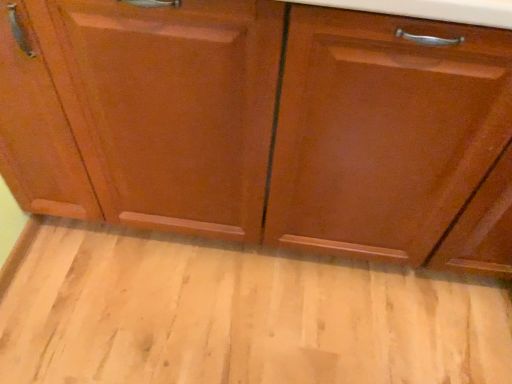
Locate an element on the screen. The width and height of the screenshot is (512, 384). matte wood floor at lower center is located at coordinates (239, 315).

What do you see at coordinates (239, 315) in the screenshot? The image size is (512, 384). I see `matte wood floor at lower center` at bounding box center [239, 315].

The height and width of the screenshot is (384, 512). What do you see at coordinates (429, 25) in the screenshot? I see `glossy wood drawer at right` at bounding box center [429, 25].

Locate an element on the screen. glossy wood drawer at right is located at coordinates (429, 25).

Locate an element on the screen. matte wood floor at lower center is located at coordinates (239, 315).

Which object is positioned more to the left, matte wood floor at lower center or glossy wood drawer at right?

From the viewer's perspective, matte wood floor at lower center appears more on the left side.

In the scene shown: Considering the relative positions of matte wood floor at lower center and glossy wood drawer at right in the image provided, is matte wood floor at lower center in front of glossy wood drawer at right?

No, matte wood floor at lower center is further to the viewer.

Considering the positions of points (198, 346) and (400, 24), is point (198, 346) farther from camera compared to point (400, 24)?

That is True.

From the image's perspective, which object appears higher, matte wood floor at lower center or glossy wood drawer at right?

glossy wood drawer at right, from the image's perspective.

From a real-world perspective, between matte wood floor at lower center and glossy wood drawer at right, who is vertically higher?

From a 3D spatial view, glossy wood drawer at right is above.

Considering the sizes of objects matte wood floor at lower center and glossy wood drawer at right in the image provided, who is thinner, matte wood floor at lower center or glossy wood drawer at right?

With smaller width is glossy wood drawer at right.

Is matte wood floor at lower center taller than glossy wood drawer at right?

Incorrect, the height of matte wood floor at lower center is not larger of that of glossy wood drawer at right.

Considering the sizes of matte wood floor at lower center and glossy wood drawer at right in the image, is matte wood floor at lower center bigger or smaller than glossy wood drawer at right?

In the image, matte wood floor at lower center appears to be smaller than glossy wood drawer at right.

Is matte wood floor at lower center outside of glossy wood drawer at right?

That's correct, matte wood floor at lower center is outside of glossy wood drawer at right.

Can you see matte wood floor at lower center touching glossy wood drawer at right?

No.

Does matte wood floor at lower center turn towards glossy wood drawer at right?

No, matte wood floor at lower center is not facing towards glossy wood drawer at right.

How many degrees apart are the facing directions of matte wood floor at lower center and glossy wood drawer at right?

There is a 179-degree angle between the facing directions of matte wood floor at lower center and glossy wood drawer at right.

Identify the location of drawer above the matte wood floor at lower center (from the image's perspective). The height and width of the screenshot is (384, 512). (429, 25).

Considering the positions of objects glossy wood drawer at right and matte wood floor at lower center in the image provided, who is more to the left, glossy wood drawer at right or matte wood floor at lower center?

Positioned to the left is matte wood floor at lower center.

Is the depth of glossy wood drawer at right greater than that of matte wood floor at lower center?

No, glossy wood drawer at right is closer to the viewer.

Which is behind, point (401, 44) or point (430, 372)?

The point (430, 372) is more distant.

From the image's perspective, which is above, glossy wood drawer at right or matte wood floor at lower center?

From the image's view, glossy wood drawer at right is above.

From a real-world perspective, does glossy wood drawer at right stand above matte wood floor at lower center?

Indeed, from a real-world perspective, glossy wood drawer at right stands above matte wood floor at lower center.

Does glossy wood drawer at right have a greater width compared to matte wood floor at lower center?

No.

Which of these two, glossy wood drawer at right or matte wood floor at lower center, stands taller?

With more height is glossy wood drawer at right.

Does glossy wood drawer at right have a smaller size compared to matte wood floor at lower center?

No, glossy wood drawer at right is not smaller than matte wood floor at lower center.

Is matte wood floor at lower center completely or partially inside glossy wood drawer at right?

No, matte wood floor at lower center is not inside glossy wood drawer at right.

Is glossy wood drawer at right not close to matte wood floor at lower center?

No, glossy wood drawer at right is not far away from matte wood floor at lower center.

Is glossy wood drawer at right facing away from matte wood floor at lower center?

No.

The image size is (512, 384). In order to click on drawer located on the right of matte wood floor at lower center in this screenshot , I will do `click(429, 25)`.

What are the coordinates of `plain located underneath the glossy wood drawer at right (from a real-world perspective)` in the screenshot? It's located at (239, 315).

Locate an element on the screen. drawer positioned vertically above the matte wood floor at lower center (from a real-world perspective) is located at coordinates (429, 25).